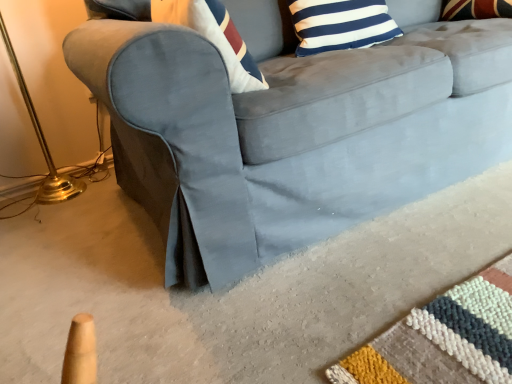
Describe the element at coordinates (289, 127) in the screenshot. I see `suede gray couch at center` at that location.

Describe the element at coordinates (340, 24) in the screenshot. I see `blue and white striped pillow at upper center` at that location.

I want to click on gold metallic table lamp at left, so click(42, 141).

Where is `suede gray couch at center`? suede gray couch at center is located at coordinates (289, 127).

Which of these two, suede gray couch at center or gold metallic table lamp at left, is smaller?

gold metallic table lamp at left.

Would you consider suede gray couch at center to be distant from gold metallic table lamp at left?

Yes, suede gray couch at center and gold metallic table lamp at left are located far from each other.

Do you think suede gray couch at center is within gold metallic table lamp at left, or outside of it?

suede gray couch at center cannot be found inside gold metallic table lamp at left.

Is gold metallic table lamp at left facing away from suede gray couch at center?

No, gold metallic table lamp at left is not facing away from suede gray couch at center.

Is the position of gold metallic table lamp at left more distant than that of suede gray couch at center?

Yes, gold metallic table lamp at left is further from the viewer.

Between gold metallic table lamp at left and suede gray couch at center, which one appears on the right side from the viewer's perspective?

From the viewer's perspective, suede gray couch at center appears more on the right side.

How different are the orientations of blue and white striped pillow at upper center and suede gray couch at center in degrees?

0.0815 degrees.

Looking at this image, from a real-world perspective, is blue and white striped pillow at upper center above or below suede gray couch at center?

blue and white striped pillow at upper center is situated higher than suede gray couch at center in the real world.

Is blue and white striped pillow at upper center next to suede gray couch at center?

No, blue and white striped pillow at upper center is not making contact with suede gray couch at center.

From the image's perspective, does blue and white striped pillow at upper center appear higher than suede gray couch at center?

Yes, from the image's perspective, blue and white striped pillow at upper center is above suede gray couch at center.

Is blue and white striped pillow at upper center inside gold metallic table lamp at left?

A: No, blue and white striped pillow at upper center is not a part of gold metallic table lamp at left.

Between gold metallic table lamp at left and blue and white striped pillow at upper center, which one appears on the right side from the viewer's perspective?

From the viewer's perspective, blue and white striped pillow at upper center appears more on the right side.

Would you consider gold metallic table lamp at left to be distant from blue and white striped pillow at upper center?

Yes, gold metallic table lamp at left and blue and white striped pillow at upper center are quite far apart.

Is the depth of gold metallic table lamp at left less than that of blue and white striped pillow at upper center?

Yes, it is in front of blue and white striped pillow at upper center.

From the image's perspective, which is above, blue and white striped pillow at upper center or gold metallic table lamp at left?

blue and white striped pillow at upper center, from the image's perspective.

Which object is more forward, blue and white striped pillow at upper center or gold metallic table lamp at left?

Positioned in front is gold metallic table lamp at left.

Could you measure the distance between blue and white striped pillow at upper center and gold metallic table lamp at left?

blue and white striped pillow at upper center is 3.86 feet from gold metallic table lamp at left.

Is blue and white striped pillow at upper center not close to gold metallic table lamp at left?

Indeed, blue and white striped pillow at upper center is not near gold metallic table lamp at left.

Is point (482, 74) closer or farther from the camera than point (316, 27)?

Point (482, 74) appears to be closer to the viewer than point (316, 27).

Is suede gray couch at center placed right next to blue and white striped pillow at upper center?

suede gray couch at center is not next to blue and white striped pillow at upper center, and they're not touching.

Based on the photo, do you think suede gray couch at center is within blue and white striped pillow at upper center, or outside of it?

suede gray couch at center is not enclosed by blue and white striped pillow at upper center.

Which object is more forward, suede gray couch at center or blue and white striped pillow at upper center?

Positioned in front is suede gray couch at center.

Find the location of a particular element. This screenshot has width=512, height=384. table lamp located on the left of suede gray couch at center is located at coordinates (42, 141).

Where is `table lamp above the suede gray couch at center (from a real-world perspective)`? The height and width of the screenshot is (384, 512). table lamp above the suede gray couch at center (from a real-world perspective) is located at coordinates (42, 141).

Estimate the real-world distances between objects in this image. Which object is further from blue and white striped pillow at upper center, suede gray couch at center or gold metallic table lamp at left?

gold metallic table lamp at left lies further to blue and white striped pillow at upper center than the other object.

From the image, which object appears to be farther from gold metallic table lamp at left, blue and white striped pillow at upper center or suede gray couch at center?

blue and white striped pillow at upper center is positioned further to the anchor gold metallic table lamp at left.

Which object lies nearer to the anchor point gold metallic table lamp at left, suede gray couch at center or blue and white striped pillow at upper center?

suede gray couch at center.

Considering their positions, is gold metallic table lamp at left positioned further to blue and white striped pillow at upper center than suede gray couch at center?

gold metallic table lamp at left is further to blue and white striped pillow at upper center.

Which object lies nearer to the anchor point suede gray couch at center, gold metallic table lamp at left or blue and white striped pillow at upper center?

blue and white striped pillow at upper center.

Considering their positions, is blue and white striped pillow at upper center positioned further to suede gray couch at center than gold metallic table lamp at left?

gold metallic table lamp at left lies further to suede gray couch at center than the other object.

The width and height of the screenshot is (512, 384). Identify the location of pillow situated between gold metallic table lamp at left and suede gray couch at center from left to right. (340, 24).